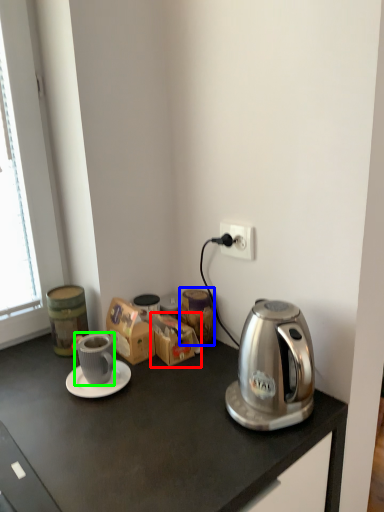
Question: Estimate the real-world distances between objects in this image. Which object is closer to cardboard box (highlighted by a red box), appliance (highlighted by a blue box) or coffee cup (highlighted by a green box)?

Choices:
 (A) appliance
 (B) coffee cup

Answer: (A)